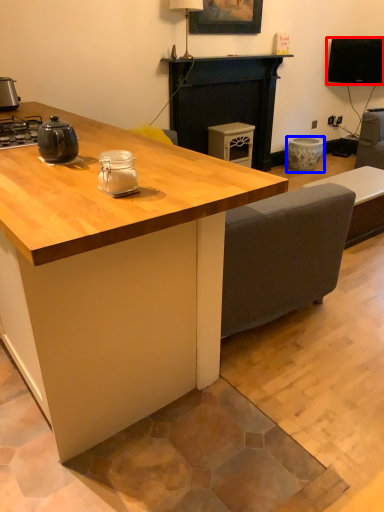
Question: Which object is further to the camera taking this photo, television (highlighted by a red box) or appliance (highlighted by a blue box)?

Choices:
 (A) television
 (B) appliance

Answer: (B)